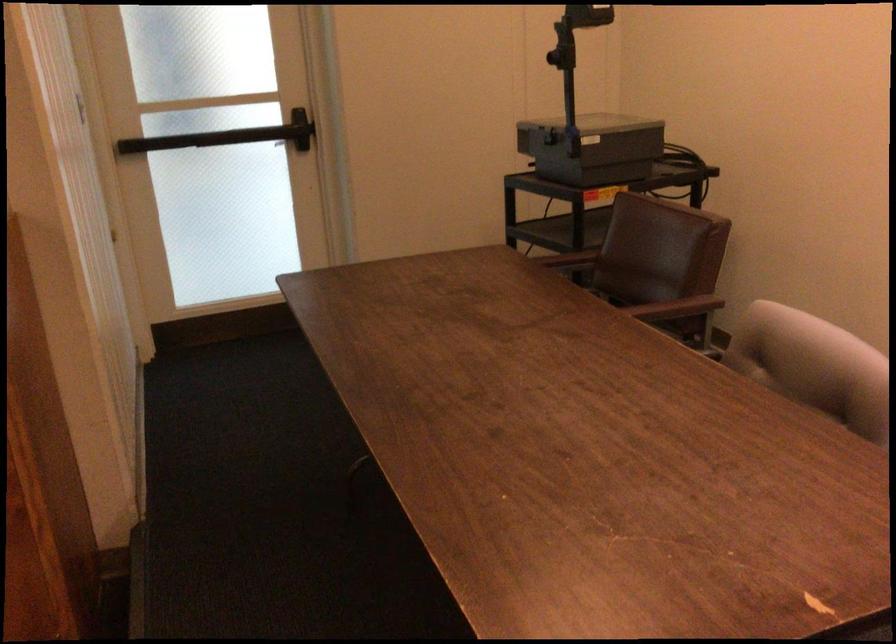
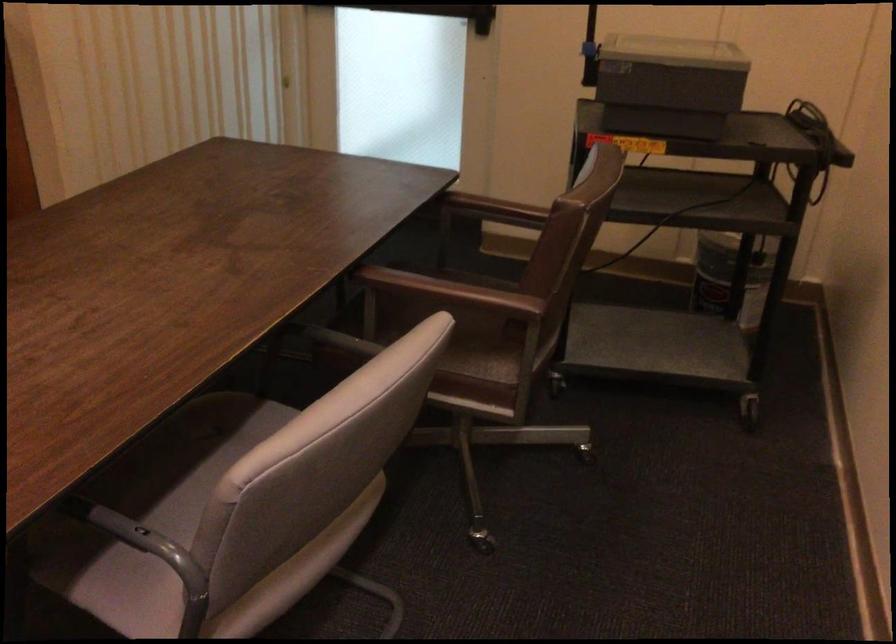
In the second image, find the point that corresponds to (x=806, y=462) in the first image.

(140, 538)